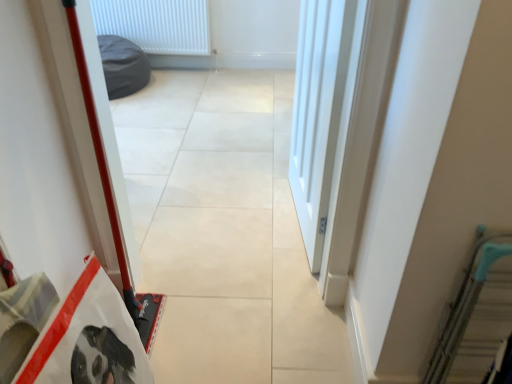
Question: Is white plastic radiator at upper center taller than beige tile floor at center?

Choices:
 (A) yes
 (B) no

Answer: (B)

Question: Is white plastic radiator at upper center in front of beige tile floor at center?

Choices:
 (A) no
 (B) yes

Answer: (A)

Question: Is white plastic radiator at upper center thinner than beige tile floor at center?

Choices:
 (A) no
 (B) yes

Answer: (B)

Question: Is white plastic radiator at upper center to the right of beige tile floor at center from the viewer's perspective?

Choices:
 (A) yes
 (B) no

Answer: (B)

Question: Could you tell me if white plastic radiator at upper center is facing beige tile floor at center?

Choices:
 (A) no
 (B) yes

Answer: (B)

Question: Is beige tile floor at center in front of or behind teal metallic escalator at right in the image?

Choices:
 (A) behind
 (B) front

Answer: (A)

Question: From the image's perspective, is beige tile floor at center positioned above or below teal metallic escalator at right?

Choices:
 (A) below
 (B) above

Answer: (B)

Question: Is beige tile floor at center spatially inside teal metallic escalator at right, or outside of it?

Choices:
 (A) outside
 (B) inside

Answer: (A)

Question: Is beige tile floor at center bigger or smaller than teal metallic escalator at right?

Choices:
 (A) big
 (B) small

Answer: (A)

Question: Does point (487, 319) appear closer or farther from the camera than point (338, 102)?

Choices:
 (A) closer
 (B) farther

Answer: (A)

Question: Is teal metallic escalator at right bigger or smaller than white smooth door at center?

Choices:
 (A) big
 (B) small

Answer: (B)

Question: From a real-world perspective, relative to white smooth door at center, is teal metallic escalator at right vertically above or below?

Choices:
 (A) above
 (B) below

Answer: (B)

Question: Is teal metallic escalator at right to the left or to the right of white smooth door at center in the image?

Choices:
 (A) right
 (B) left

Answer: (A)

Question: From the image's perspective, is teal metallic escalator at right above or below beige tile floor at center?

Choices:
 (A) below
 (B) above

Answer: (A)

Question: Looking at their shapes, would you say teal metallic escalator at right is wider or thinner than beige tile floor at center?

Choices:
 (A) wide
 (B) thin

Answer: (B)